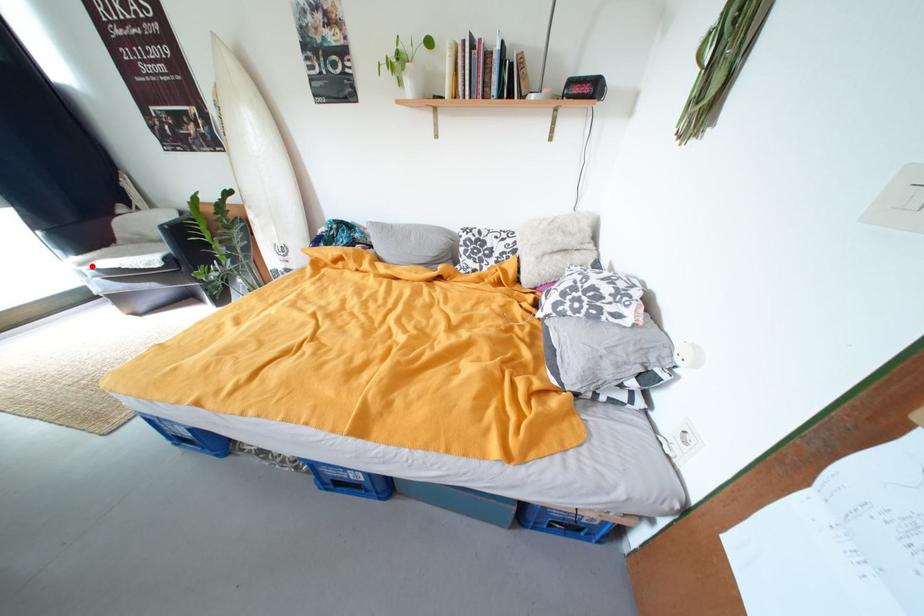
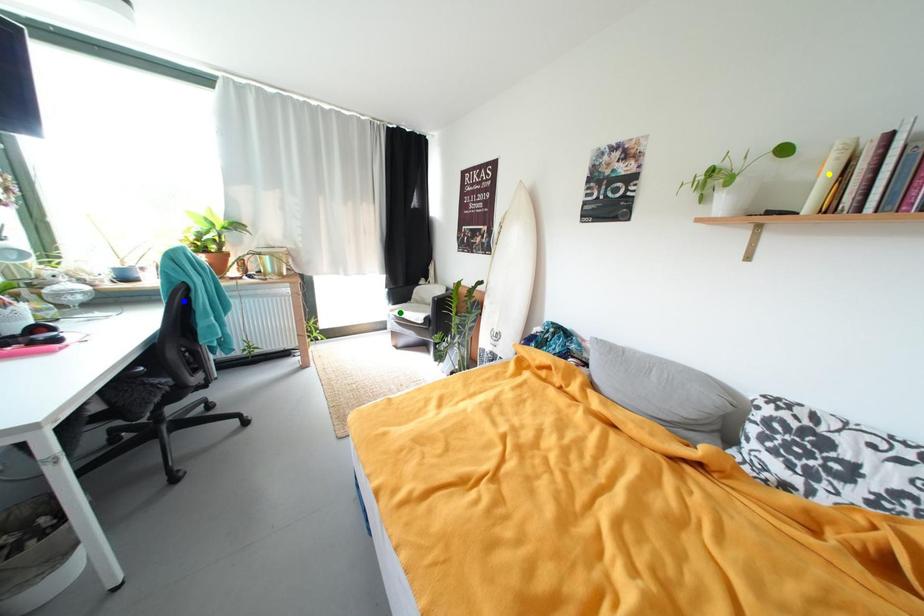
Question: I am providing you with two images of the same scene from different viewpoints. A red point is marked on the first image. You are given multiple points on the second image. In image 2, which mark is for the same physical point as the one in image 1?

Choices:
 (A) yellow point
 (B) green point
 (C) blue point

Answer: (B)